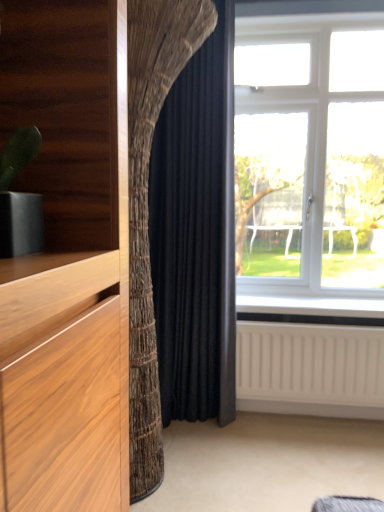
Question: Would you say black velvet curtain at center is to the left or to the right of white plastic window at right in the picture?

Choices:
 (A) left
 (B) right

Answer: (A)

Question: From their relative heights in the image, would you say black velvet curtain at center is taller or shorter than white plastic window at right?

Choices:
 (A) short
 (B) tall

Answer: (B)

Question: Estimate the real-world distances between objects in this image. Which object is closer to the white plastic window at right?

Choices:
 (A) white textured radiator at lower right
 (B) black velvet curtain at center

Answer: (B)

Question: Which is farther from the white textured radiator at lower right?

Choices:
 (A) black velvet curtain at center
 (B) white plastic window at right

Answer: (B)